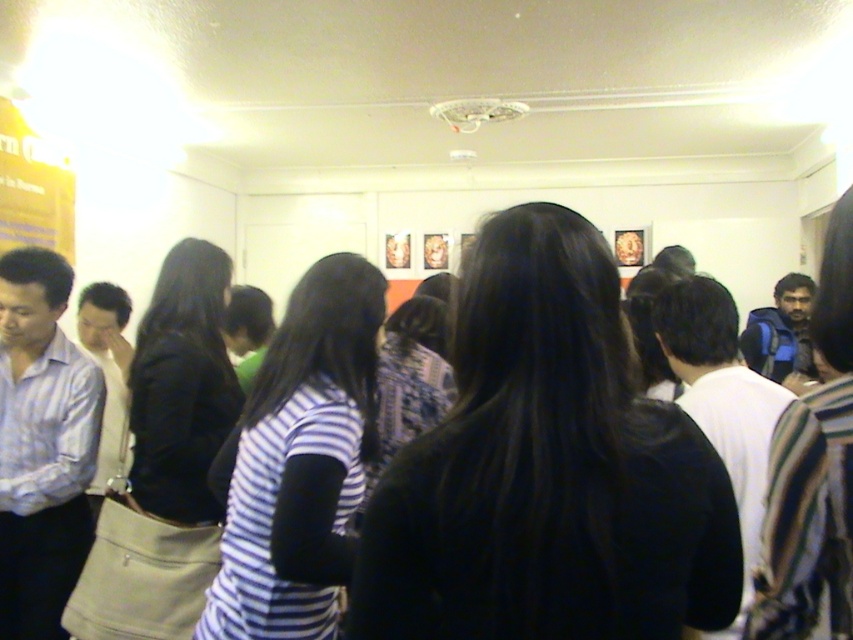
Question: Can you confirm if black matte hair at center is positioned below striped fabric shirt at center?

Choices:
 (A) yes
 (B) no

Answer: (B)

Question: Which object is positioned farthest from the matte black jacket at left?

Choices:
 (A) striped fabric shirt at center
 (B) black matte hair at center

Answer: (B)

Question: Which point is closer to the camera?

Choices:
 (A) black matte hair at center
 (B) matte black jacket at left
 (C) striped fabric shirt at center

Answer: (A)

Question: Is black matte hair at center wider than matte black jacket at left?

Choices:
 (A) yes
 (B) no

Answer: (A)

Question: Where is striped fabric shirt at center located in relation to matte black jacket at left in the image?

Choices:
 (A) below
 (B) above

Answer: (B)

Question: Considering the real-world distances, which object is farthest from the striped fabric shirt at center?

Choices:
 (A) black matte hair at center
 (B) matte black jacket at left

Answer: (A)